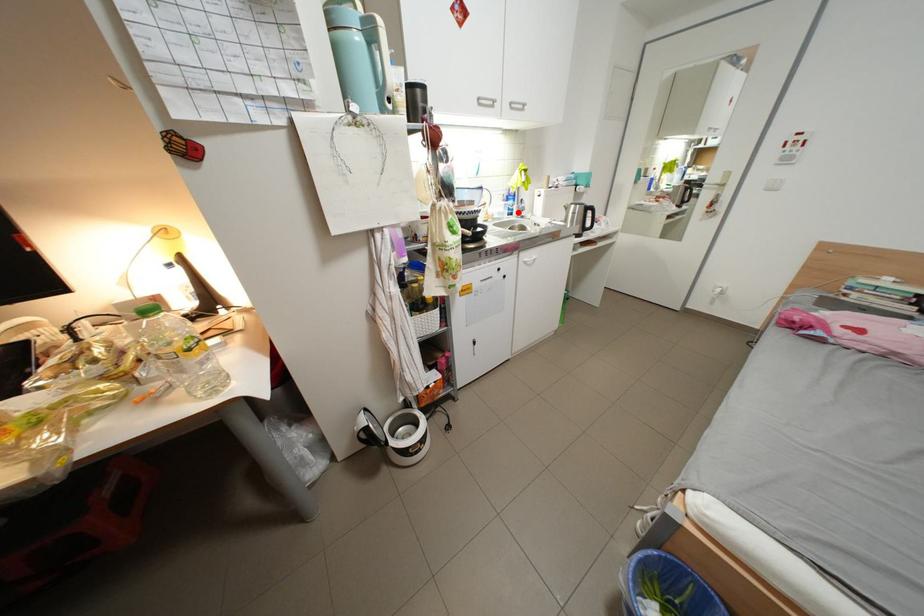
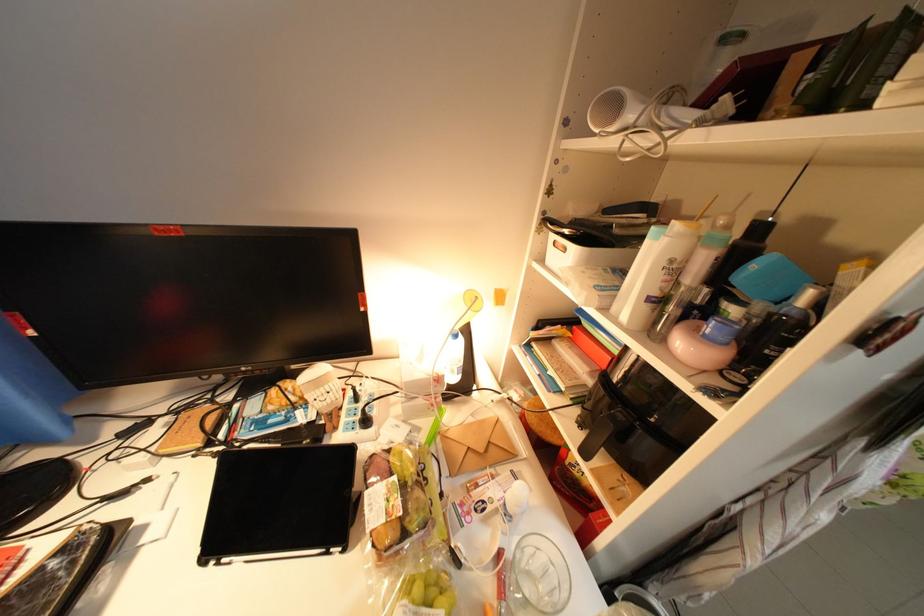
Question: I am providing you with two images of the same scene from different viewpoints. A red point is marked on the first image. At the location where the point appears in image 1, is it still visible in image 2?

Choices:
 (A) Yes
 (B) No

Answer: (B)